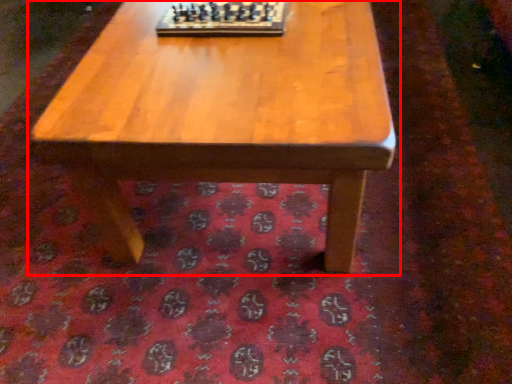
Question: From the image, what is the correct spatial relationship of coffee table (annotated by the red box) in relation to board game?

Choices:
 (A) right
 (B) left

Answer: (A)